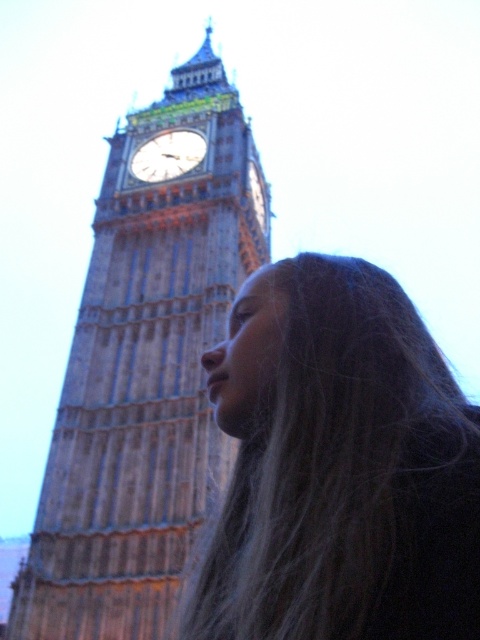
Consider the image. Between dark brown hair at center and gold-toned metal clock at upper center, which one has less height?

gold-toned metal clock at upper center

Does dark brown hair at center appear on the left side of gold-toned metal clock at upper center?

In fact, dark brown hair at center is to the right of gold-toned metal clock at upper center.

Is point (239, 419) closer to camera compared to point (146, 180)?

Yes, point (239, 419) is in front of point (146, 180).

Find the location of a particular element. This screenshot has height=640, width=480. dark brown hair at center is located at coordinates (336, 467).

Which is above, stone clock tower at upper left or gold-colored metal clock at upper center?

stone clock tower at upper left is above.

From the picture: Does stone clock tower at upper left appear on the left side of gold-colored metal clock at upper center?

Correct, you'll find stone clock tower at upper left to the left of gold-colored metal clock at upper center.

Image resolution: width=480 pixels, height=640 pixels. Identify the location of stone clock tower at upper left. (144, 376).

Identify the location of stone clock tower at upper left. The image size is (480, 640). (144, 376).

Where is `dark brown hair at center`? This screenshot has width=480, height=640. dark brown hair at center is located at coordinates (336, 467).

Find the location of a particular element. The height and width of the screenshot is (640, 480). dark brown hair at center is located at coordinates (336, 467).